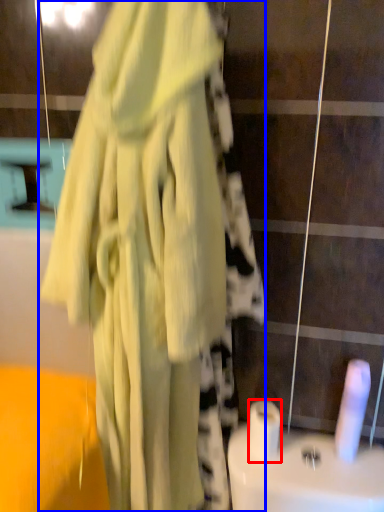
Question: Among these objects, which one is farthest to the camera, toilet paper (highlighted by a red box) or fancy dress (highlighted by a blue box)?

Choices:
 (A) toilet paper
 (B) fancy dress

Answer: (A)